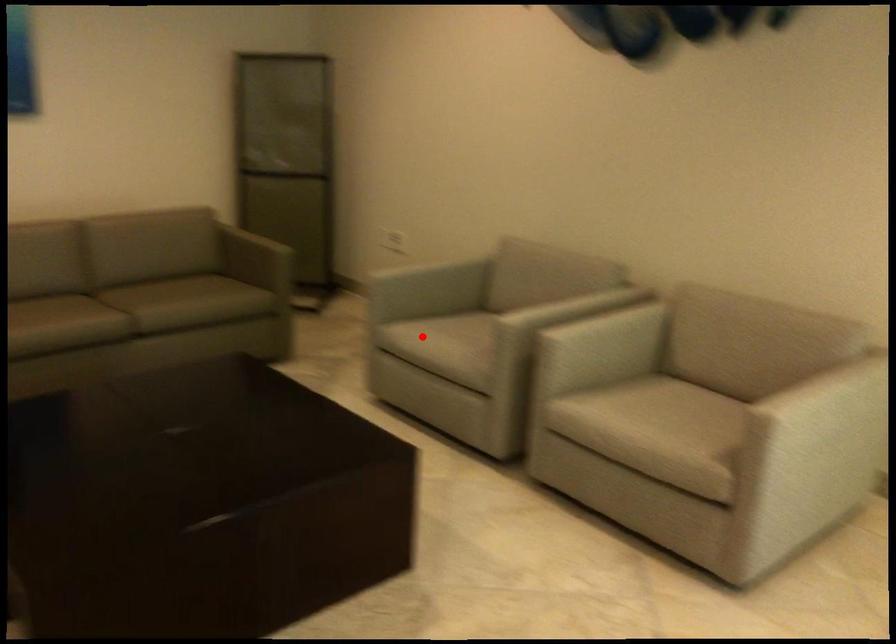
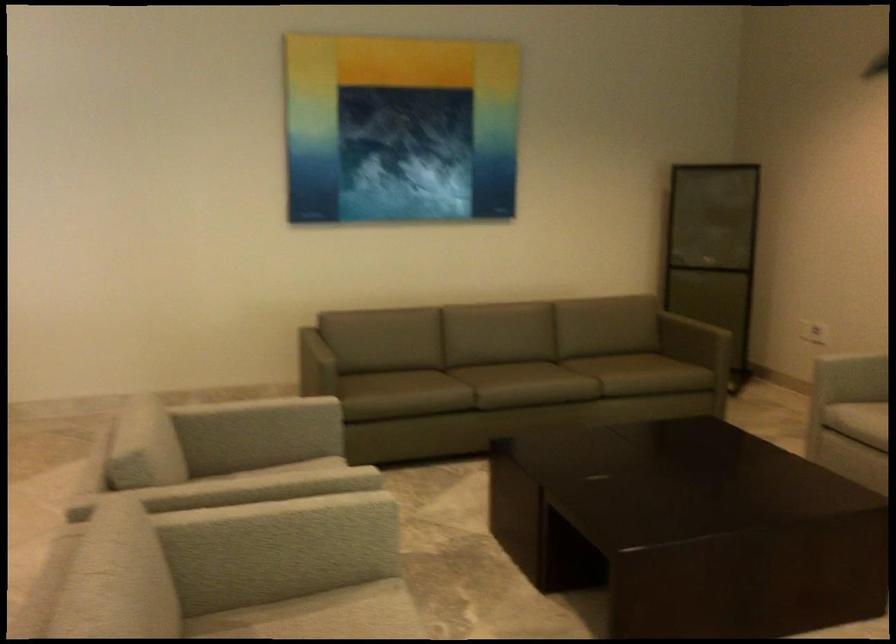
Question: A red point is marked in image1. In image2, is the corresponding 3D point closer to the camera or farther? Reply with the corresponding letter.

Choices:
 (A) The corresponding 3D point is closer.
 (B) The corresponding 3D point is farther.

Answer: (B)